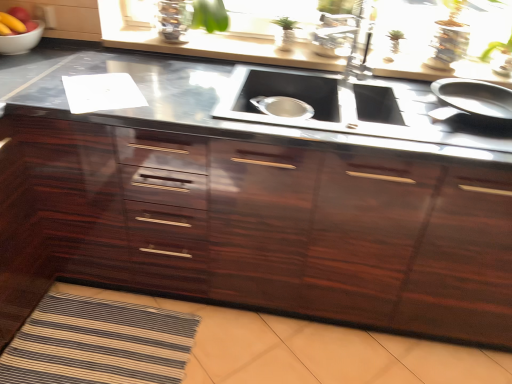
This screenshot has height=384, width=512. Find the location of `smooth red apple at upper left`. smooth red apple at upper left is located at coordinates (17, 21).

Image resolution: width=512 pixels, height=384 pixels. Describe the element at coordinates (21, 41) in the screenshot. I see `white glossy bowl at upper left` at that location.

Identify the location of smooth red apple at upper left. The image size is (512, 384). (17, 21).

From the image's perspective, is glossy wood cabinetry at center located above white glossy bowl at upper left?

No, from the image's perspective, glossy wood cabinetry at center is not on top of white glossy bowl at upper left.

Is white glossy bowl at upper left located within glossy wood cabinetry at center?

Actually, white glossy bowl at upper left is outside glossy wood cabinetry at center.

In the scene shown: Considering the sizes of objects glossy wood cabinetry at center and white glossy bowl at upper left in the image provided, who is taller, glossy wood cabinetry at center or white glossy bowl at upper left?

Standing taller between the two is glossy wood cabinetry at center.

Is glossy wood cabinetry at center next to white glossy bowl at upper left and touching it?

No, glossy wood cabinetry at center is not in contact with white glossy bowl at upper left.

From the image's perspective, between black stainless steel sink at center and glossy wood cabinetry at center, who is located below?

glossy wood cabinetry at center appears lower in the image.

Which object is positioned more to the right, black stainless steel sink at center or glossy wood cabinetry at center?

From the viewer's perspective, black stainless steel sink at center appears more on the right side.

From a real-world perspective, who is located lower, black stainless steel sink at center or glossy wood cabinetry at center?

From a 3D spatial view, glossy wood cabinetry at center is below.

What's the angular difference between smooth red apple at upper left and white glossy bowl at upper left's facing directions?

2.89 degrees separate the facing orientations of smooth red apple at upper left and white glossy bowl at upper left.

Does smooth red apple at upper left come in front of white glossy bowl at upper left?

Yes, the depth of smooth red apple at upper left is less than that of white glossy bowl at upper left.

From the image's perspective, does smooth red apple at upper left appear higher than white glossy bowl at upper left?

Indeed, from the image's perspective, smooth red apple at upper left is shown above white glossy bowl at upper left.

Is smooth red apple at upper left next to white glossy bowl at upper left and touching it?

Yes, smooth red apple at upper left is with white glossy bowl at upper left.

From a real-world perspective, is white glossy bowl at upper left on top of smooth red apple at upper left?

Incorrect, from a real-world perspective, white glossy bowl at upper left is lower than smooth red apple at upper left.

Is white glossy bowl at upper left oriented away from smooth red apple at upper left?

No, white glossy bowl at upper left is not facing away from smooth red apple at upper left.

Does white glossy bowl at upper left appear on the right side of smooth red apple at upper left?

Correct, you'll find white glossy bowl at upper left to the right of smooth red apple at upper left.

Is smooth red apple at upper left a part of white glossy bowl at upper left?

No, smooth red apple at upper left is not a part of white glossy bowl at upper left.

Is glossy wood cabinetry at center oriented away from black stainless steel sink at center?

Yes.

Does glossy wood cabinetry at center have a greater height compared to black stainless steel sink at center?

Yes, glossy wood cabinetry at center is taller than black stainless steel sink at center.

Is glossy wood cabinetry at center further to camera compared to black stainless steel sink at center?

No, glossy wood cabinetry at center is in front of black stainless steel sink at center.

Is black stainless steel sink at center a part of glossy wood cabinetry at center?

Indeed, black stainless steel sink at center is located within glossy wood cabinetry at center.

From a real-world perspective, between black stainless steel sink at center and white glossy bowl at upper left, who is vertically lower?

black stainless steel sink at center.

Who is bigger, black stainless steel sink at center or white glossy bowl at upper left?

black stainless steel sink at center is bigger.

Which is correct: black stainless steel sink at center is inside white glossy bowl at upper left, or outside of it?

black stainless steel sink at center exists outside the volume of white glossy bowl at upper left.

From a real-world perspective, relative to smooth red apple at upper left, is black stainless steel sink at center vertically above or below?

black stainless steel sink at center is situated lower than smooth red apple at upper left in the real world.

Considering the positions of objects black stainless steel sink at center and smooth red apple at upper left in the image provided, who is behind, black stainless steel sink at center or smooth red apple at upper left?

smooth red apple at upper left.

Can you confirm if black stainless steel sink at center is thinner than smooth red apple at upper left?

Incorrect, the width of black stainless steel sink at center is not less than that of smooth red apple at upper left.

Is black stainless steel sink at center positioned with its back to smooth red apple at upper left?

No.

This screenshot has height=384, width=512. What are the coordinates of `mixing bowl positioned vertically above the glossy wood cabinetry at center (from a real-world perspective)` in the screenshot? It's located at (21, 41).

This screenshot has height=384, width=512. Identify the location of stove on the right of glossy wood cabinetry at center. (353, 109).

When comparing their distances from glossy wood cabinetry at center, does white glossy bowl at upper left or smooth red apple at upper left seem closer?

The object closer to glossy wood cabinetry at center is white glossy bowl at upper left.

Estimate the real-world distances between objects in this image. Which object is further from glossy wood cabinetry at center, white glossy bowl at upper left or black stainless steel sink at center?

Answer: white glossy bowl at upper left.

When comparing their distances from smooth red apple at upper left, does black stainless steel sink at center or glossy wood cabinetry at center seem closer?

glossy wood cabinetry at center lies closer to smooth red apple at upper left than the other object.

From the image, which object appears to be nearer to glossy wood cabinetry at center, smooth red apple at upper left or black stainless steel sink at center?

The object closer to glossy wood cabinetry at center is black stainless steel sink at center.

When comparing their distances from glossy wood cabinetry at center, does black stainless steel sink at center or white glossy bowl at upper left seem further?

white glossy bowl at upper left is positioned further to the anchor glossy wood cabinetry at center.

Estimate the real-world distances between objects in this image. Which object is closer to glossy wood cabinetry at center, black stainless steel sink at center or smooth red apple at upper left?

black stainless steel sink at center is closer to glossy wood cabinetry at center.

Which object lies further to the anchor point smooth red apple at upper left, white glossy bowl at upper left or black stainless steel sink at center?

The object further to smooth red apple at upper left is black stainless steel sink at center.

Looking at this image, considering their positions, is glossy wood cabinetry at center positioned further to white glossy bowl at upper left than black stainless steel sink at center?

black stainless steel sink at center is positioned further to the anchor white glossy bowl at upper left.

Where is `cabinetry situated between white glossy bowl at upper left and black stainless steel sink at center from left to right`? This screenshot has width=512, height=384. cabinetry situated between white glossy bowl at upper left and black stainless steel sink at center from left to right is located at coordinates (276, 226).

Where is `mixing bowl between smooth red apple at upper left and glossy wood cabinetry at center from left to right`? This screenshot has width=512, height=384. mixing bowl between smooth red apple at upper left and glossy wood cabinetry at center from left to right is located at coordinates (x=21, y=41).

At what (x,y) coordinates should I click in order to perform the action: click on mixing bowl situated between smooth red apple at upper left and black stainless steel sink at center from left to right. Please return your answer as a coordinate pair (x, y). This screenshot has height=384, width=512. Looking at the image, I should click on (21, 41).

This screenshot has height=384, width=512. Identify the location of cabinetry between smooth red apple at upper left and black stainless steel sink at center from left to right. (276, 226).